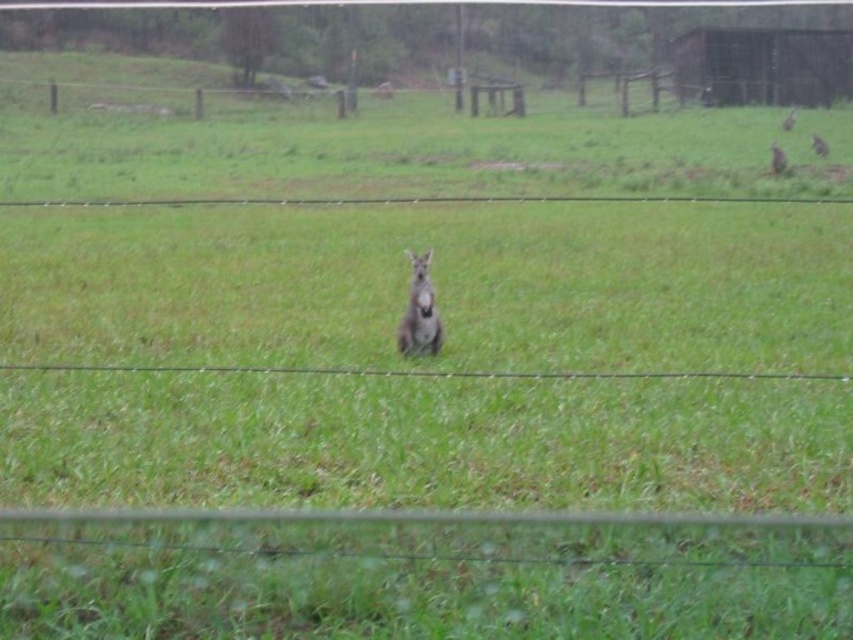
The image size is (853, 640). I want to click on metal wire fence at lower center, so click(421, 576).

Can you confirm if metal wire fence at lower center is positioned to the right of fuzzy gray kangaroo at center?

Indeed, metal wire fence at lower center is positioned on the right side of fuzzy gray kangaroo at center.

This screenshot has height=640, width=853. Find the location of `metal wire fence at lower center`. metal wire fence at lower center is located at coordinates (421, 576).

This screenshot has width=853, height=640. Find the location of `metal wire fence at lower center`. metal wire fence at lower center is located at coordinates (421, 576).

Between gray furry kangaroo at upper right and gray furry kangaroo at right, which one appears on the left side from the viewer's perspective?

From the viewer's perspective, gray furry kangaroo at upper right appears more on the left side.

Which is above, gray furry kangaroo at upper right or gray furry kangaroo at right?

gray furry kangaroo at right is higher up.

Which is in front, point (817, 141) or point (786, 131)?

Point (817, 141)

Locate an element on the screen. gray furry kangaroo at upper right is located at coordinates (817, 145).

Is fuzzy gray kangaroo at center further to the viewer compared to furry gray kangaroo at upper right?

No, fuzzy gray kangaroo at center is closer to the viewer.

Can you confirm if fuzzy gray kangaroo at center is positioned below furry gray kangaroo at upper right?

Yes.

Find the location of a particular element. fuzzy gray kangaroo at center is located at coordinates (419, 310).